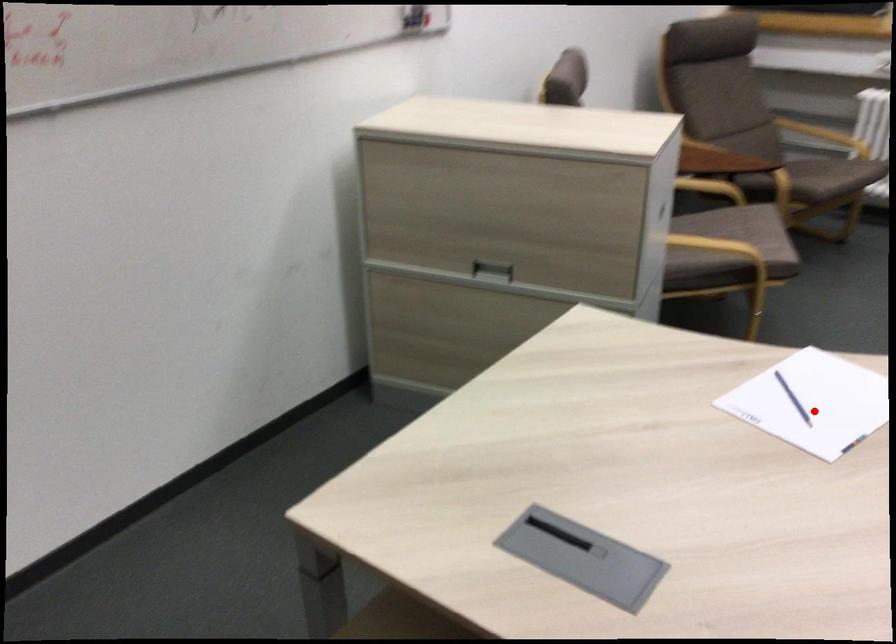
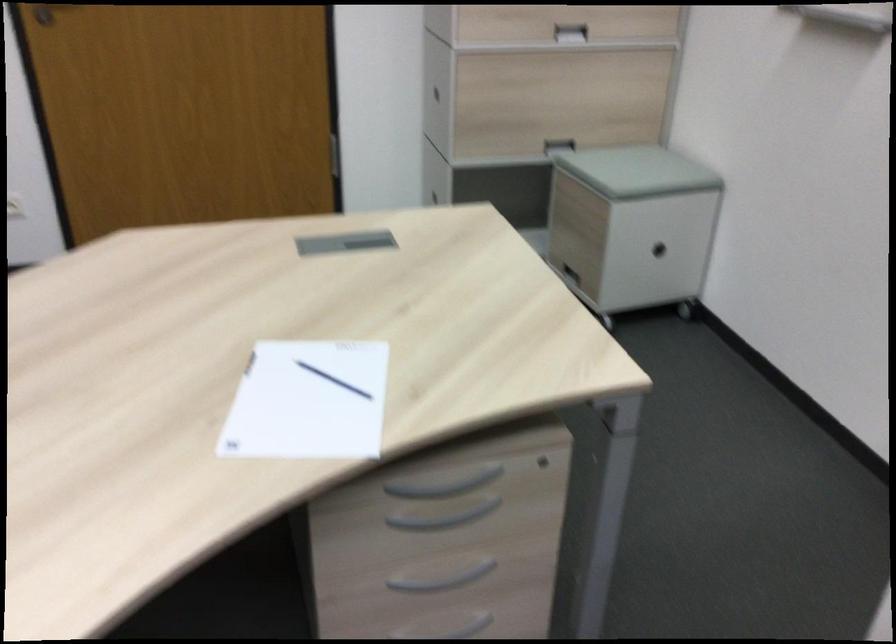
In the second image, find the point that corresponds to the highlighted location in the first image.

(307, 402)